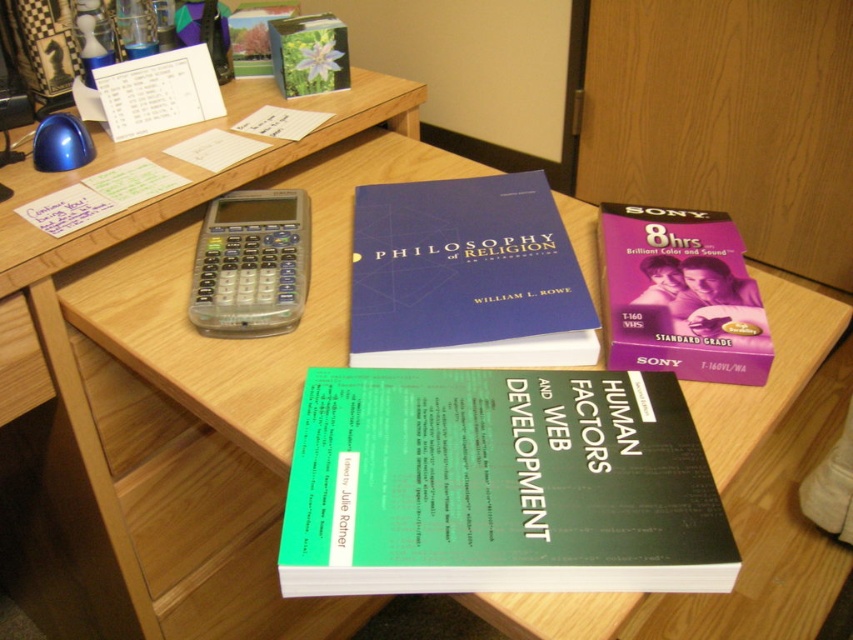
Question: Which point is closer to the camera taking this photo?

Choices:
 (A) (689, 212)
 (B) (44, 397)
 (C) (398, 218)

Answer: (B)

Question: Does matte blue book at center have a larger size compared to purple plastic tape at upper right?

Choices:
 (A) no
 (B) yes

Answer: (B)

Question: Where is green matte book at center located in relation to matte blue book at center in the image?

Choices:
 (A) right
 (B) left

Answer: (A)

Question: Considering the real-world distances, which object is farthest from the purple plastic tape at upper right?

Choices:
 (A) wooden drawer at lower left
 (B) green matte book at center
 (C) matte blue book at center

Answer: (A)

Question: Which point is farther to the camera?

Choices:
 (A) click(416, 241)
 (B) click(36, 371)
 (C) click(755, 336)

Answer: (A)

Question: Is matte blue book at center closer to camera compared to purple plastic tape at upper right?

Choices:
 (A) yes
 (B) no

Answer: (B)